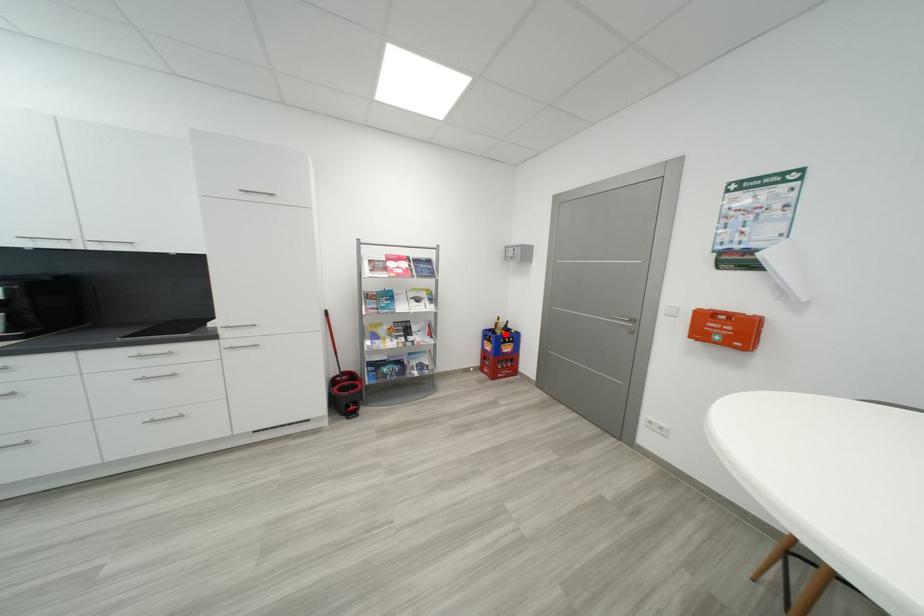
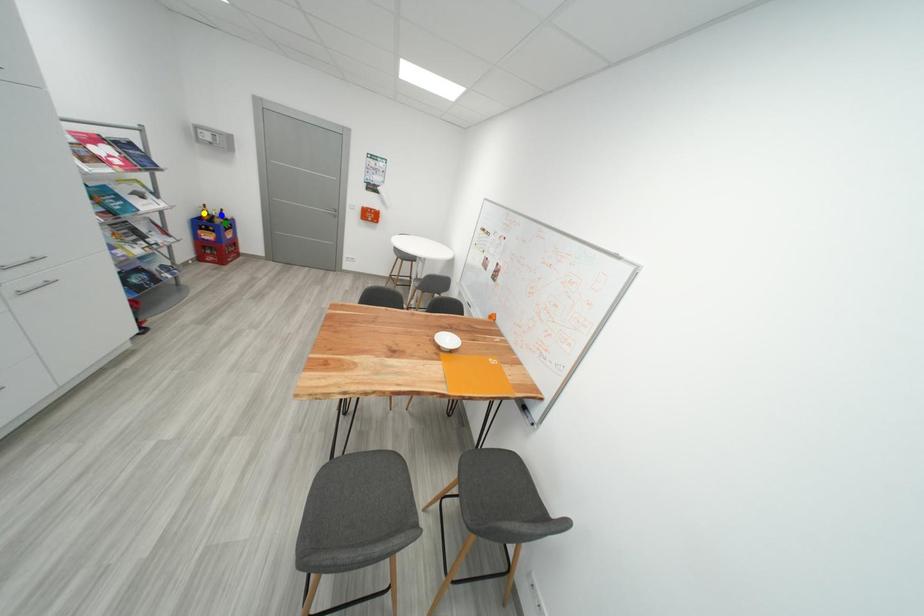
Question: I am providing you with two images of the same scene from different viewpoints. A red point is marked on the first image. You are given multiple points on the second image. Which point in image 2 is actually the same real-world point as the red point in image 1?

Choices:
 (A) green point
 (B) blue point
 (C) yellow point

Answer: (A)